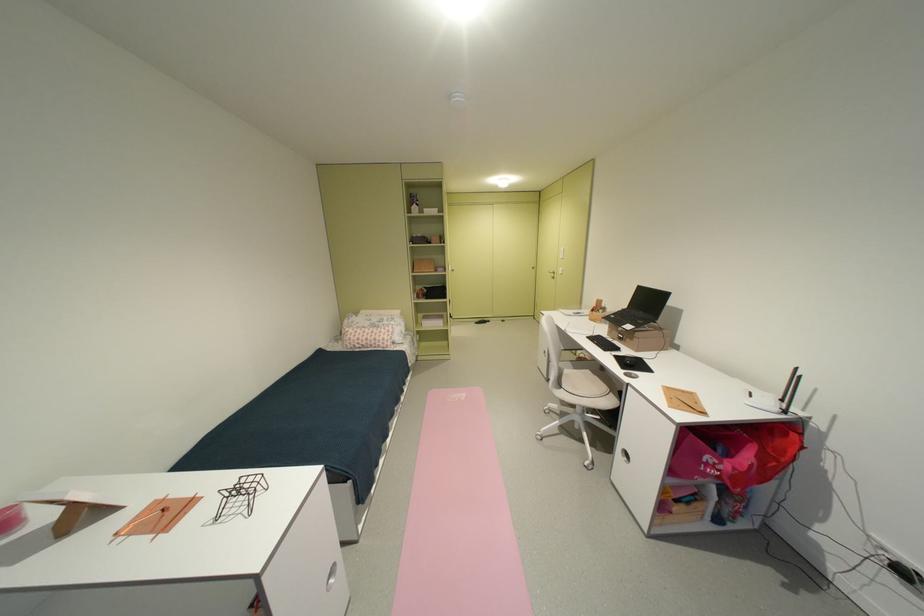
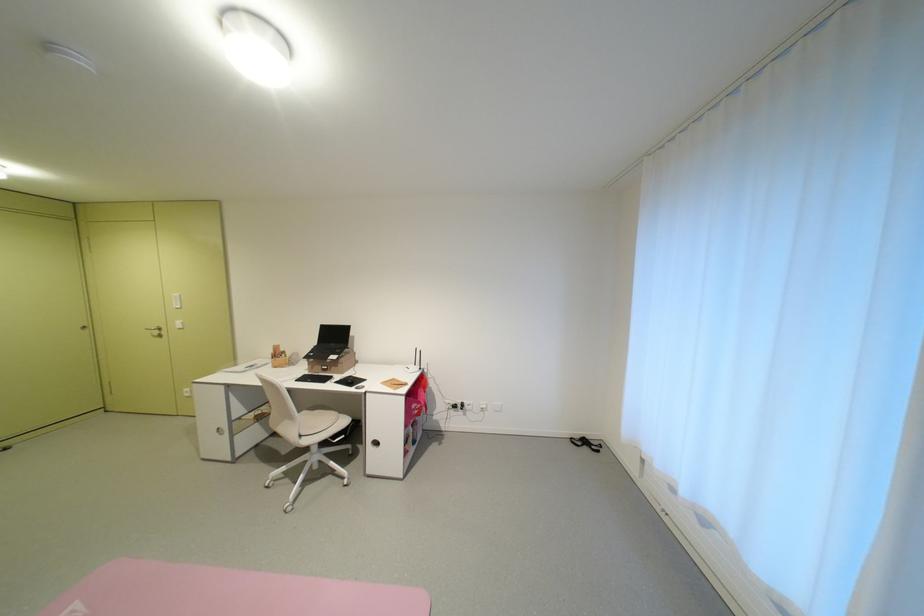
Question: The camera is either moving clockwise (left) or counter-clockwise (right) around the object. The first image is from the beginning of the video and the second image is from the end. Is the camera moving left or right when shooting the video?

Choices:
 (A) Left
 (B) Right

Answer: (A)